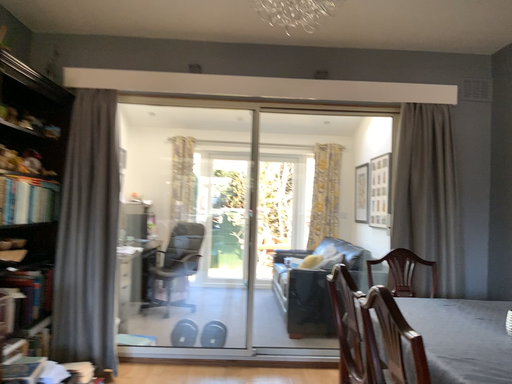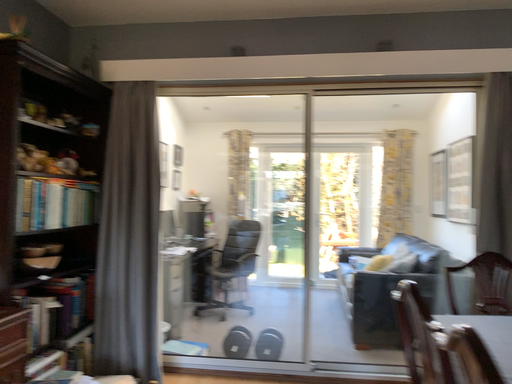
Question: How did the camera likely rotate when shooting the video?

Choices:
 (A) rotated right
 (B) rotated left

Answer: (B)